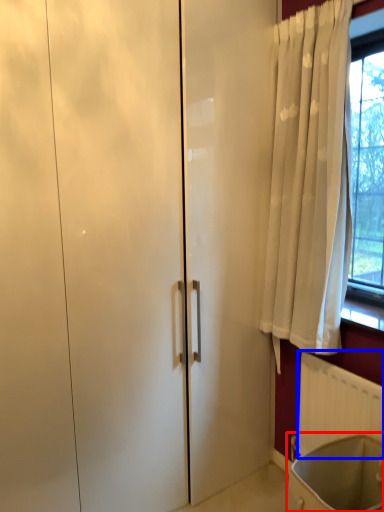
Question: Which object appears closest to the camera in this image, bath (highlighted by a red box) or radiator (highlighted by a blue box)?

Choices:
 (A) bath
 (B) radiator

Answer: (A)